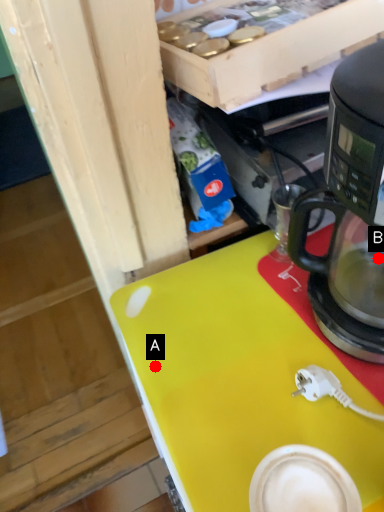
Question: Two points are circled on the image, labeled by A and B beside each circle. Among these points, which one is nearest to the camera?

Choices:
 (A) A is closer
 (B) B is closer

Answer: (A)